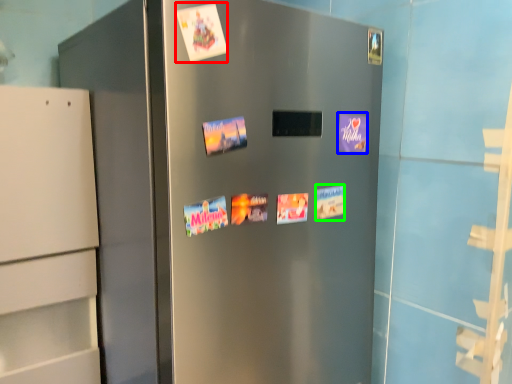
Question: Based on their relative distances, which object is nearer to flyer (highlighted by a red box)? Choose from postcard (highlighted by a blue box) and postcard (highlighted by a green box).

Choices:
 (A) postcard
 (B) postcard

Answer: (A)